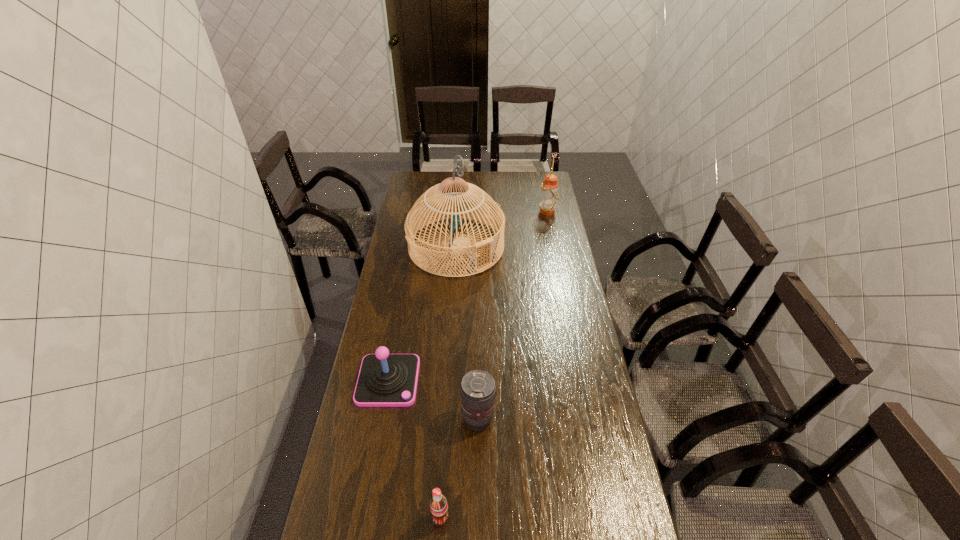
Where is `vacant space in between the nearest object and the telephoto lens`? The width and height of the screenshot is (960, 540). vacant space in between the nearest object and the telephoto lens is located at coordinates (459, 468).

Identify the location of free spot between the soda and the telephoto lens. This screenshot has height=540, width=960. (459, 468).

Identify the location of free space between the telephoto lens and the joystick. (433, 400).

At what (x,y) coordinates should I click in order to perform the action: click on vacant region between the rightmost object and the telephoto lens. Please return your answer as a coordinate pair (x, y). The height and width of the screenshot is (540, 960). Looking at the image, I should click on (513, 315).

Where is `empty space that is in between the oil lamp and the joystick`? empty space that is in between the oil lamp and the joystick is located at coordinates (468, 296).

You are a GUI agent. You are given a task and a screenshot of the screen. Output one action in this format:
    pyautogui.click(x=<x>, y=<y>)
    Task: Click on the free space between the second farthest object and the joystick
    The width and height of the screenshot is (960, 540).
    Given the screenshot: What is the action you would take?
    pyautogui.click(x=422, y=314)

Choose which object is the third nearest neighbor to the birdcage. Please provide its 2D coordinates. Your answer should be formatted as a tuple, i.e. [(x, y)], where the tuple contains the x and y coordinates of a point satisfying the conditions above.

[(478, 388)]

Identify which object is located as the fourth nearest to the oil lamp. Please provide its 2D coordinates. Your answer should be formatted as a tuple, i.e. [(x, y)], where the tuple contains the x and y coordinates of a point satisfying the conditions above.

[(438, 505)]

You are a GUI agent. You are given a task and a screenshot of the screen. Output one action in this format:
    pyautogui.click(x=<x>, y=<y>)
    Task: Click on the free space that satisfies the following two spatial constraints: 1. forward from the base of the joystick; 2. on the left side of the nearest object
    Image resolution: width=960 pixels, height=540 pixels.
    Given the screenshot: What is the action you would take?
    pyautogui.click(x=363, y=517)

Where is `vacant space that satisfies the following two spatial constraints: 1. forward from the base of the nearest object; 2. on the left side of the joystick`? This screenshot has height=540, width=960. vacant space that satisfies the following two spatial constraints: 1. forward from the base of the nearest object; 2. on the left side of the joystick is located at coordinates pyautogui.click(x=363, y=517).